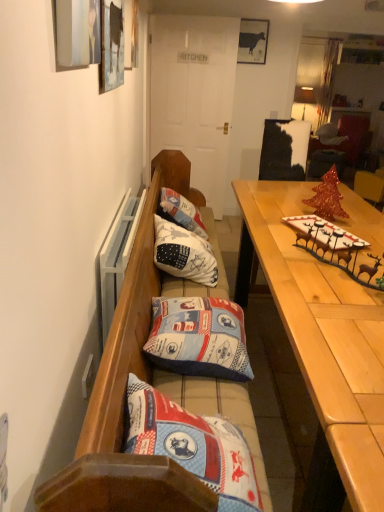
Question: Which direction should I rotate to face white cotton cushion at center, which appears as the 2th pillow when viewed from the front, — up or down?

Choices:
 (A) down
 (B) up

Answer: (B)

Question: From the image's perspective, is wooden bench with cushions at center above matte black cow at upper center?

Choices:
 (A) no
 (B) yes

Answer: (A)

Question: Considering the relative sizes of wooden bench with cushions at center and matte black cow at upper center in the image provided, is wooden bench with cushions at center taller than matte black cow at upper center?

Choices:
 (A) no
 (B) yes

Answer: (B)

Question: Does wooden bench with cushions at center have a larger size compared to matte black cow at upper center?

Choices:
 (A) yes
 (B) no

Answer: (A)

Question: Is wooden bench with cushions at center located outside matte black cow at upper center?

Choices:
 (A) yes
 (B) no

Answer: (A)

Question: Are wooden bench with cushions at center and matte black cow at upper center making contact?

Choices:
 (A) yes
 (B) no

Answer: (B)

Question: Is there a large distance between wooden bench with cushions at center and matte black cow at upper center?

Choices:
 (A) no
 (B) yes

Answer: (B)

Question: Can you confirm if matte black cabinet at upper right is shorter than matte black cow at upper center?

Choices:
 (A) yes
 (B) no

Answer: (B)

Question: Is matte black cabinet at upper right to the right of matte black cow at upper center from the viewer's perspective?

Choices:
 (A) no
 (B) yes

Answer: (B)

Question: Is matte black cabinet at upper right next to matte black cow at upper center and touching it?

Choices:
 (A) yes
 (B) no

Answer: (B)

Question: From a real-world perspective, does matte black cabinet at upper right sit lower than matte black cow at upper center?

Choices:
 (A) yes
 (B) no

Answer: (A)

Question: Is matte black cabinet at upper right facing towards matte black cow at upper center?

Choices:
 (A) yes
 (B) no

Answer: (A)

Question: From a real-world perspective, is matte black cabinet at upper right located higher than matte black cow at upper center?

Choices:
 (A) no
 (B) yes

Answer: (A)

Question: Is light wood table at right beside white cotton cushion at center, the first pillow from the back?

Choices:
 (A) yes
 (B) no

Answer: (B)